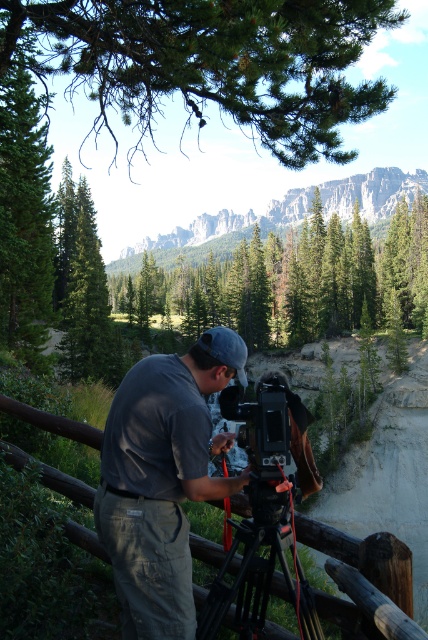
Based on the photo, you are a photographer trying to frame a shot of the gray cotton shirt at center and the brown wooden fence at lower center. Which object should you focus on first if you want to ensure both are in the frame?

The gray cotton shirt at center is below the brown wooden fence at lower center, so you should focus on the brown wooden fence at lower center first to ensure both are in the frame.

You are standing at the point marked by the coordinate point at (255, 554). The photographer is 4.37 meters away from you. In which direction should you move to get closer to the photographer?

Since the photographer is 4.37 meters away from the point marked by the coordinate point at (255, 554), you should move towards the photographer to reduce the distance between you and the photographer.

You are a hiker who has just reached the peak of a mountain. You see two points marked on the map at coordinates point [190,371] and point [342,550]. Which point is closer to your current position at the peak?

Point [342,550] is closer to your current position at the peak because point [190,371] is behind it.